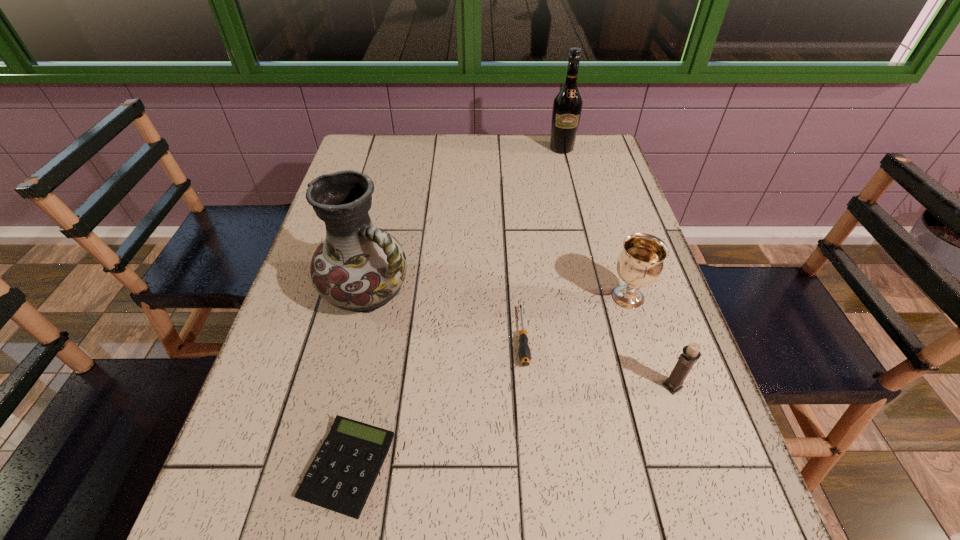
Locate an element on the screen. The width and height of the screenshot is (960, 540). wine bottle is located at coordinates (567, 107).

You are a GUI agent. You are given a task and a screenshot of the screen. Output one action in this format:
    pyautogui.click(x=<x>, y=<y>)
    Task: Click on the vase
    The width and height of the screenshot is (960, 540).
    Given the screenshot: What is the action you would take?
    pyautogui.click(x=358, y=267)

You are a GUI agent. You are given a task and a screenshot of the screen. Output one action in this format:
    pyautogui.click(x=<x>, y=<y>)
    Task: Click on the chalice
    This screenshot has height=540, width=960.
    Given the screenshot: What is the action you would take?
    (640, 264)

The width and height of the screenshot is (960, 540). What are the coordinates of `candle holder` in the screenshot? It's located at (691, 353).

The image size is (960, 540). Find the location of `screwdriver`. screwdriver is located at coordinates (524, 352).

Locate an element on the screen. The height and width of the screenshot is (540, 960). the fourth object from right to left is located at coordinates (524, 352).

Locate an element on the screen. This screenshot has width=960, height=540. the shortest object is located at coordinates (340, 478).

Where is `calculator`? This screenshot has height=540, width=960. calculator is located at coordinates (340, 478).

The height and width of the screenshot is (540, 960). I want to click on vacant space located on the label of the farthest object, so click(580, 222).

Identify the location of vacant space situated 0.210m on the right of the vase. The image size is (960, 540). (504, 291).